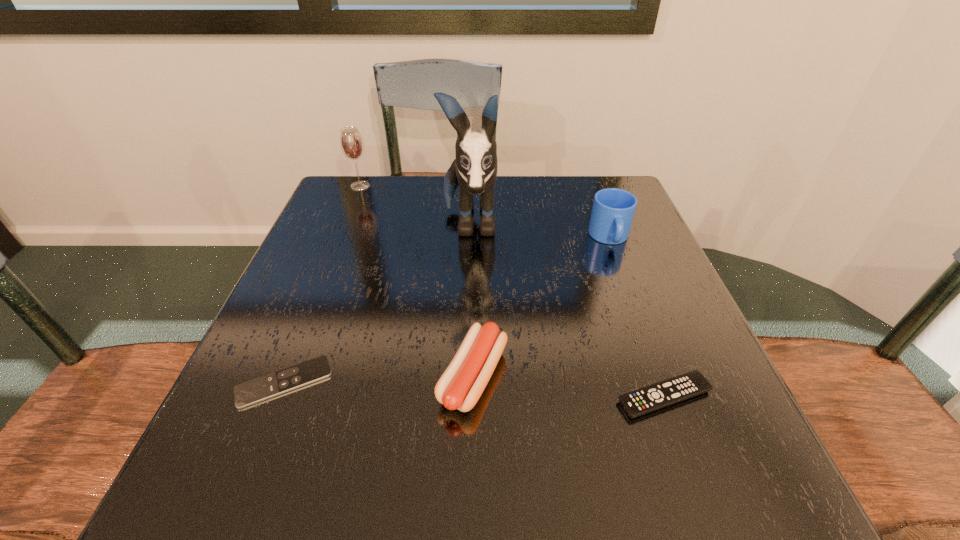
Find the location of `vacant area at the far right corner of the desktop`. vacant area at the far right corner of the desktop is located at coordinates (590, 187).

Where is `free space at the near right corner`? free space at the near right corner is located at coordinates (727, 474).

Where is `vacant point located between the taller remote control and the fourth shortest object`? This screenshot has width=960, height=540. vacant point located between the taller remote control and the fourth shortest object is located at coordinates (637, 317).

Locate an element on the screen. This screenshot has width=960, height=540. free space between the third shortest object and the fifth shortest object is located at coordinates (417, 281).

You are a GUI agent. You are given a task and a screenshot of the screen. Output one action in this format:
    pyautogui.click(x=<x>, y=<y>)
    Task: Click on the free point between the fourth tallest object and the left remote control
    This screenshot has width=960, height=540.
    Given the screenshot: What is the action you would take?
    pyautogui.click(x=379, y=380)

This screenshot has height=540, width=960. In order to click on free space that is in between the second shortest object and the tallest object in this screenshot , I will do `click(567, 310)`.

Locate an element on the screen. This screenshot has width=960, height=540. free space between the tallest object and the mug is located at coordinates (540, 231).

Find the location of a particular element. The image size is (960, 540). free spot between the fifth tallest object and the second tallest object is located at coordinates (513, 291).

You are a GUI agent. You are given a task and a screenshot of the screen. Output one action in this format:
    pyautogui.click(x=<x>, y=<y>)
    Task: Click on the free spot between the third tallest object and the fourth tallest object
    
    Given the screenshot: What is the action you would take?
    pyautogui.click(x=541, y=307)

The image size is (960, 540). What are the coordinates of `free area in between the sausage and the fifth shortest object` in the screenshot? It's located at (417, 281).